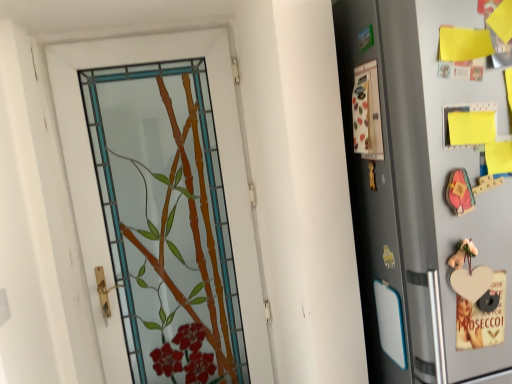
What do you see at coordinates (372, 190) in the screenshot? The height and width of the screenshot is (384, 512). I see `matte plastic screen door at right` at bounding box center [372, 190].

The height and width of the screenshot is (384, 512). Describe the element at coordinates (422, 198) in the screenshot. I see `silver metallic refrigerator at right` at that location.

Locate an element on the screen. The height and width of the screenshot is (384, 512). matte plastic screen door at right is located at coordinates (372, 190).

Does silver metallic refrigerator at right have a greater height compared to matte plastic screen door at right?

Correct, silver metallic refrigerator at right is much taller as matte plastic screen door at right.

Identify the location of screen door on the left side of silver metallic refrigerator at right. Image resolution: width=512 pixels, height=384 pixels. (372, 190).

Is silver metallic refrigerator at right oriented away from matte plastic screen door at right?

No, silver metallic refrigerator at right's orientation is not away from matte plastic screen door at right.

In the scene shown: What's the angular difference between silver metallic refrigerator at right and matte plastic screen door at right's facing directions?

87.6 degrees separate the facing orientations of silver metallic refrigerator at right and matte plastic screen door at right.

Can you confirm if matte plastic screen door at right is shorter than silver metallic refrigerator at right?

Correct, matte plastic screen door at right is not as tall as silver metallic refrigerator at right.

Is matte plastic screen door at right oriented away from silver metallic refrigerator at right?

Yes, matte plastic screen door at right is positioned with its back facing silver metallic refrigerator at right.

Does matte plastic screen door at right have a smaller size compared to silver metallic refrigerator at right?

Yes.

Does matte plastic screen door at right come behind silver metallic refrigerator at right?

That is True.

From the image's perspective, between silver metallic refrigerator at right and stained glass door at center, who is located below?

stained glass door at center, from the image's perspective.

Considering the relative positions of silver metallic refrigerator at right and stained glass door at center in the image provided, is silver metallic refrigerator at right behind stained glass door at center?

No, it is not.

Is there a large distance between silver metallic refrigerator at right and stained glass door at center?

No, there isn't a large distance between silver metallic refrigerator at right and stained glass door at center.

Between silver metallic refrigerator at right and stained glass door at center, which one has less height?

silver metallic refrigerator at right is shorter.

Can you confirm if stained glass door at center is positioned to the left of silver metallic refrigerator at right?

Yes.

Is stained glass door at center in contact with silver metallic refrigerator at right?

No, stained glass door at center is not touching silver metallic refrigerator at right.

Could you tell me if stained glass door at center is turned towards silver metallic refrigerator at right?

No, stained glass door at center is not facing towards silver metallic refrigerator at right.

From a real-world perspective, does stained glass door at center stand above silver metallic refrigerator at right?

No, from a real-world perspective, stained glass door at center is not above silver metallic refrigerator at right.

Is point (97, 306) farther from camera compared to point (378, 52)?

That is True.

Is stained glass door at center far away from matte plastic screen door at right?

No, stained glass door at center is not far away from matte plastic screen door at right.

Can you confirm if stained glass door at center is thinner than matte plastic screen door at right?

Incorrect, the width of stained glass door at center is not less than that of matte plastic screen door at right.

Which is more to the right, matte plastic screen door at right or stained glass door at center?

matte plastic screen door at right is more to the right.

Between matte plastic screen door at right and stained glass door at center, which one has larger size?

With larger size is stained glass door at center.

Is matte plastic screen door at right not close to stained glass door at center?

They are positioned close to each other.

This screenshot has height=384, width=512. I want to click on refrigerator lying on the right of matte plastic screen door at right, so click(x=422, y=198).

Locate an element on the screen. Image resolution: width=512 pixels, height=384 pixels. screen door above the silver metallic refrigerator at right (from a real-world perspective) is located at coordinates (372, 190).

Which object lies nearer to the anchor point stained glass door at center, matte plastic screen door at right or silver metallic refrigerator at right?

matte plastic screen door at right is positioned closer to the anchor stained glass door at center.

Estimate the real-world distances between objects in this image. Which object is closer to matte plastic screen door at right, stained glass door at center or silver metallic refrigerator at right?

silver metallic refrigerator at right.

Based on their spatial positions, is silver metallic refrigerator at right or matte plastic screen door at right further from stained glass door at center?

Based on the image, silver metallic refrigerator at right appears to be further to stained glass door at center.

Considering their positions, is silver metallic refrigerator at right positioned further to matte plastic screen door at right than stained glass door at center?

Among the two, stained glass door at center is located further to matte plastic screen door at right.

Which object lies nearer to the anchor point silver metallic refrigerator at right, matte plastic screen door at right or stained glass door at center?

matte plastic screen door at right lies closer to silver metallic refrigerator at right than the other object.

Consider the image. Looking at the image, which one is located further to silver metallic refrigerator at right, stained glass door at center or matte plastic screen door at right?

stained glass door at center is further to silver metallic refrigerator at right.

I want to click on screen door between stained glass door at center and silver metallic refrigerator at right in the horizontal direction, so click(x=372, y=190).